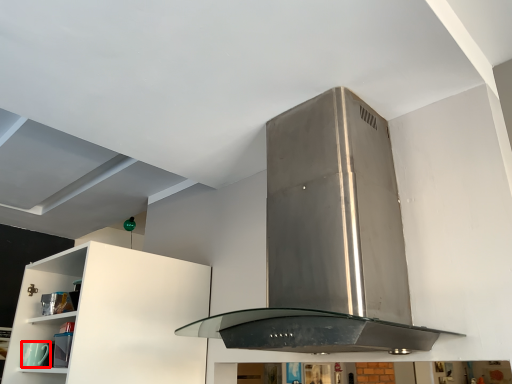
Question: Where is appliance (annotated by the red box) located in relation to home appliance in the image?

Choices:
 (A) right
 (B) left

Answer: (B)